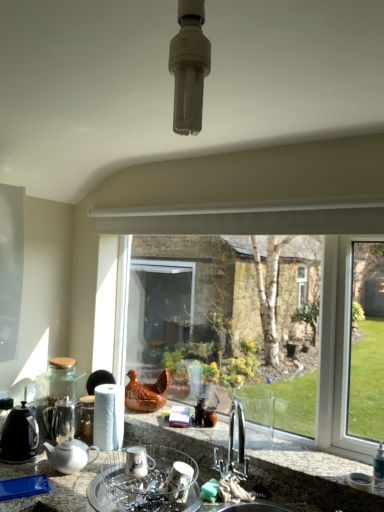
Find the location of a particular element. Image resolution: width=384 pixels, height=512 pixels. vacant space situated on the left part of white ceramic mug at lower center, the first appliance when ordered from back to front is located at coordinates (107, 477).